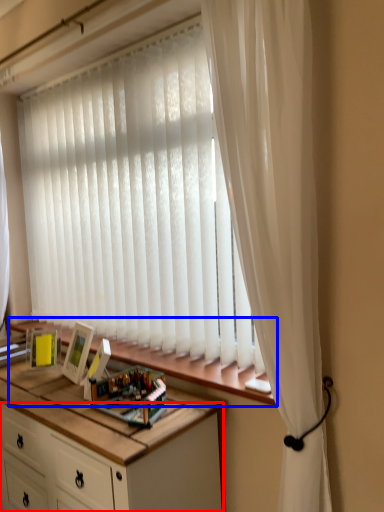
Question: Which object appears closest to the camera in this image, cabinetry (highlighted by a red box) or window sill (highlighted by a blue box)?

Choices:
 (A) cabinetry
 (B) window sill

Answer: (A)